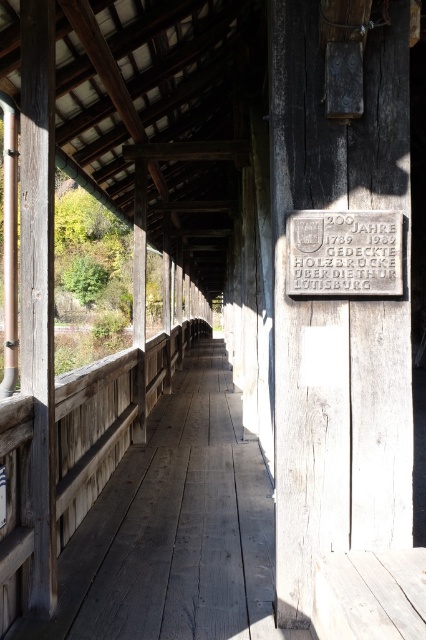
Question: Does weathered wood sign at right appear on the right side of gray stone plaque at center?

Choices:
 (A) yes
 (B) no

Answer: (B)

Question: Does weathered wood porch at center have a greater width compared to gray stone plaque at center?

Choices:
 (A) yes
 (B) no

Answer: (A)

Question: Which of the following is the farthest from the observer?

Choices:
 (A) (298, 593)
 (B) (310, 266)

Answer: (A)

Question: Which point is farther from the camera taking this photo?

Choices:
 (A) (328, 282)
 (B) (184, 428)

Answer: (B)

Question: Is weathered wood sign at right thinner than weathered wood porch at center?

Choices:
 (A) yes
 (B) no

Answer: (A)

Question: Which of the following is the farthest from the observer?

Choices:
 (A) weathered wood porch at center
 (B) gray stone plaque at center
 (C) weathered wood sign at right

Answer: (B)